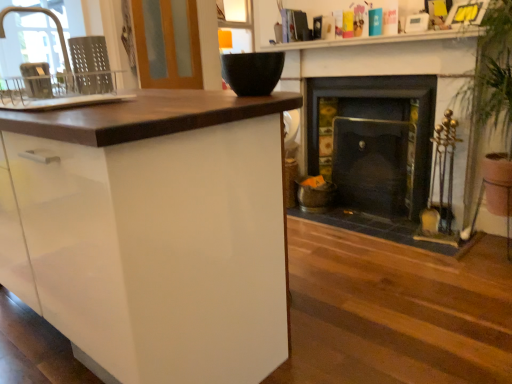
Question: From the image's perspective, is wooden screen door at upper left located beneath black matte bowl at upper center, which is the 2th appliance from left to right?

Choices:
 (A) yes
 (B) no

Answer: (B)

Question: Can you confirm if wooden screen door at upper left is taller than black matte bowl at upper center, which is the 2th appliance from left to right?

Choices:
 (A) yes
 (B) no

Answer: (A)

Question: Considering the relative sizes of wooden screen door at upper left and black matte bowl at upper center, which is the 2th appliance from left to right, in the image provided, is wooden screen door at upper left shorter than black matte bowl at upper center, which is the 2th appliance from left to right,?

Choices:
 (A) no
 (B) yes

Answer: (A)

Question: Is the depth of wooden screen door at upper left less than that of black matte bowl at upper center, the first appliance in the right-to-left sequence?

Choices:
 (A) yes
 (B) no

Answer: (B)

Question: From the image's perspective, is wooden screen door at upper left on black matte bowl at upper center, the first appliance in the right-to-left sequence?

Choices:
 (A) yes
 (B) no

Answer: (A)

Question: Are wooden screen door at upper left and black matte bowl at upper center, which is the 2th appliance from left to right, located far from each other?

Choices:
 (A) yes
 (B) no

Answer: (A)

Question: Is wooden screen door at upper left facing towards matte silver faucet at left?

Choices:
 (A) yes
 (B) no

Answer: (B)

Question: From the image's perspective, is wooden screen door at upper left below matte silver faucet at left?

Choices:
 (A) no
 (B) yes

Answer: (A)

Question: Does wooden screen door at upper left have a smaller size compared to matte silver faucet at left?

Choices:
 (A) no
 (B) yes

Answer: (A)

Question: From a real-world perspective, is wooden screen door at upper left on matte silver faucet at left?

Choices:
 (A) yes
 (B) no

Answer: (A)

Question: Is matte silver faucet at left inside wooden screen door at upper left?

Choices:
 (A) yes
 (B) no

Answer: (B)

Question: Can you confirm if wooden screen door at upper left is wider than matte silver faucet at left?

Choices:
 (A) no
 (B) yes

Answer: (A)

Question: Considering the relative sizes of dark gray stone fireplace at right, placed as the 2th fireplace when sorted from right to left, and matte black bowl at upper center in the image provided, is dark gray stone fireplace at right, placed as the 2th fireplace when sorted from right to left, taller than matte black bowl at upper center?

Choices:
 (A) no
 (B) yes

Answer: (B)